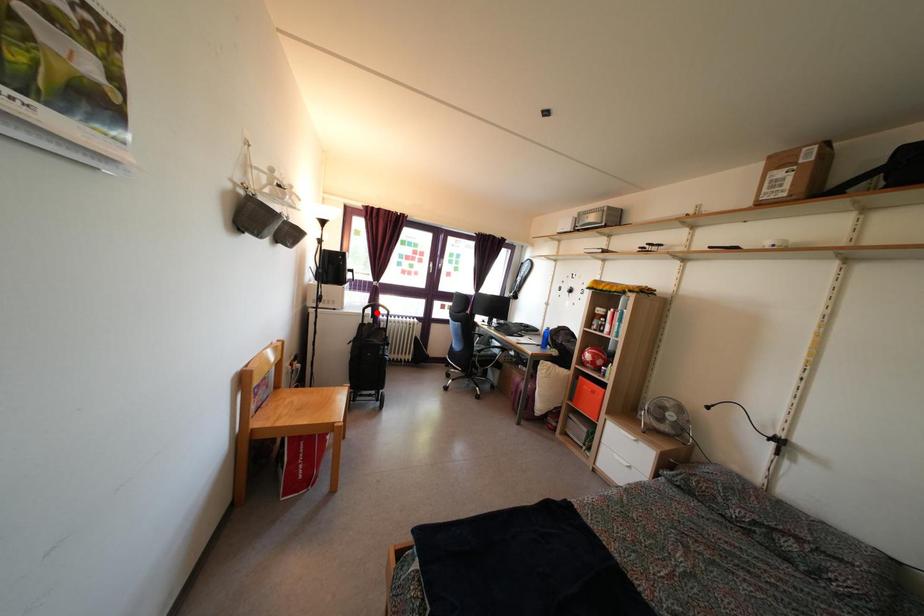
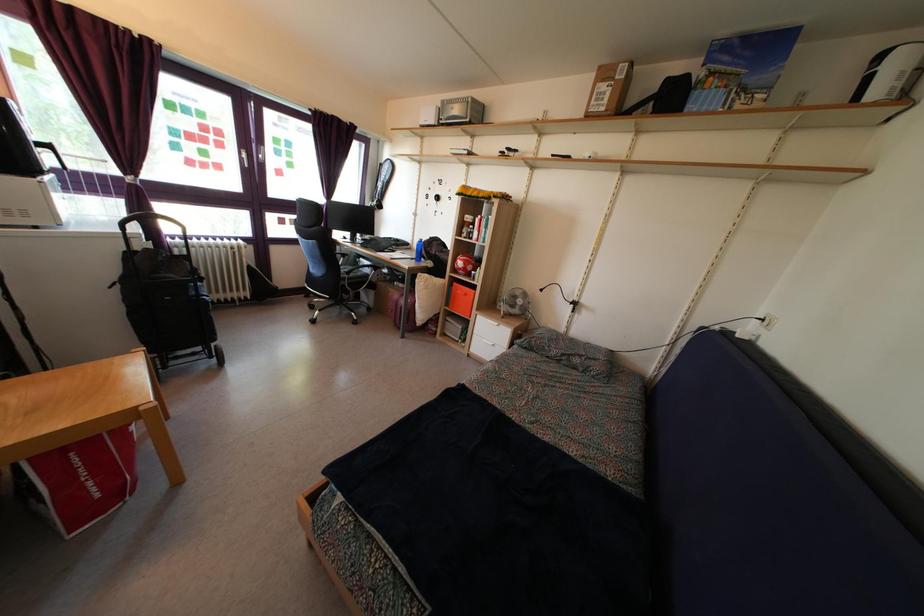
Find the pixel in the second image that matches the highlighted location in the first image.

(146, 225)